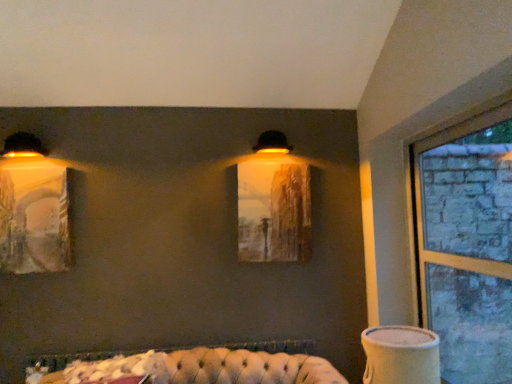
What do you see at coordinates (466, 244) in the screenshot? This screenshot has width=512, height=384. I see `clear glass window at right` at bounding box center [466, 244].

This screenshot has width=512, height=384. In order to click on matte yellow wall sconce at left, the 2th lamp viewed from the top in this screenshot , I will do `click(24, 152)`.

The width and height of the screenshot is (512, 384). What do you see at coordinates (24, 152) in the screenshot? I see `matte yellow wall sconce at left, the second lamp from the bottom` at bounding box center [24, 152].

You are a GUI agent. You are given a task and a screenshot of the screen. Output one action in this format:
    pyautogui.click(x=<x>, y=<y>)
    Task: Click on the matte black lampshade at upper center, arranged as the third lamp when ordered from the bottom
    This screenshot has width=512, height=384.
    Given the screenshot: What is the action you would take?
    pyautogui.click(x=272, y=143)

In order to face matte black lampshade at upper center, marked as the 3th lamp in a left-to-right arrangement, should I rotate leftwards or rightwards?

You should look right and rotate roughly 2.201 degrees.

Describe the element at coordinates (401, 355) in the screenshot. This screenshot has height=384, width=512. I see `white ceramic vase at lower right` at that location.

The width and height of the screenshot is (512, 384). Identify the location of tufted leather couch at lower center. (204, 368).

Considering the relative positions of tufted leather couch at lower center and matte glass painting at center in the image provided, is tufted leather couch at lower center to the right of matte glass painting at center from the viewer's perspective?

Incorrect, tufted leather couch at lower center is not on the right side of matte glass painting at center.

Is tufted leather couch at lower center with matte glass painting at center?

tufted leather couch at lower center and matte glass painting at center are not in contact.

Is tufted leather couch at lower center oriented towards matte glass painting at center?

No.

Would you say tufted leather couch at lower center is inside or outside matte glass painting at center?

tufted leather couch at lower center is not inside matte glass painting at center, it's outside.

Does white ceramic vase at lower right have a smaller size compared to matte yellow wall sconce at left, which appears as the third lamp when viewed from the right?

Actually, white ceramic vase at lower right might be larger than matte yellow wall sconce at left, which appears as the third lamp when viewed from the right.

Based on the photo, does white ceramic vase at lower right have a greater height compared to matte yellow wall sconce at left, the 2th lamp viewed from the top?

Indeed, white ceramic vase at lower right has a greater height compared to matte yellow wall sconce at left, the 2th lamp viewed from the top.

Considering the sizes of objects white ceramic vase at lower right and matte yellow wall sconce at left, the 2th lamp viewed from the top, in the image provided, who is wider, white ceramic vase at lower right or matte yellow wall sconce at left, the 2th lamp viewed from the top,?

white ceramic vase at lower right.

This screenshot has height=384, width=512. Identify the location of the 2nd lamp above the white ceramic vase at lower right (from a real-world perspective). (24, 152).

From a real-world perspective, who is located higher, matte glass painting at center or white ceramic vase at lower right?

matte glass painting at center.

Is matte glass painting at center wider than white ceramic vase at lower right?

Incorrect, the width of matte glass painting at center does not surpass that of white ceramic vase at lower right.

From the image's perspective, between matte glass painting at center and white ceramic vase at lower right, who is located below?

white ceramic vase at lower right is shown below in the image.

Which is nearer, (x=292, y=211) or (x=35, y=266)?

The point (x=35, y=266) is more forward.

From the image's perspective, would you say matte glass painting at center is positioned over matte yellow lampshade at left, which is counted as the second lamp, starting from the right?

Yes, from the image's perspective, matte glass painting at center is above matte yellow lampshade at left, which is counted as the second lamp, starting from the right.

Considering the relative positions of matte glass painting at center and matte yellow lampshade at left, positioned as the third lamp in top-to-bottom order, in the image provided, is matte glass painting at center behind matte yellow lampshade at left, positioned as the third lamp in top-to-bottom order,?

Yes, it is behind matte yellow lampshade at left, positioned as the third lamp in top-to-bottom order.

Measure the distance from matte glass painting at center to matte yellow lampshade at left, which is counted as the second lamp, starting from the right.

A distance of 3.94 feet exists between matte glass painting at center and matte yellow lampshade at left, which is counted as the second lamp, starting from the right.

Does point (271, 138) appear closer or farther from the camera than point (368, 333)?

Point (271, 138) appears to be farther away from the viewer than point (368, 333).

Can you confirm if matte black lampshade at upper center, arranged as the third lamp when ordered from the bottom, is taller than white ceramic vase at lower right?

No.

Looking at this image, from a real-world perspective, is matte black lampshade at upper center, marked as the 3th lamp in a left-to-right arrangement, above or below white ceramic vase at lower right?

In terms of real-world spatial position, matte black lampshade at upper center, marked as the 3th lamp in a left-to-right arrangement, is above white ceramic vase at lower right.

Is white ceramic vase at lower right located within matte black lampshade at upper center, marked as the 3th lamp in a left-to-right arrangement?

No, matte black lampshade at upper center, marked as the 3th lamp in a left-to-right arrangement, does not contain white ceramic vase at lower right.

Could you tell me if matte yellow lampshade at left, which is counted as the second lamp, starting from the right, is facing matte yellow wall sconce at left, the 1th lamp viewed from the left?

No, matte yellow lampshade at left, which is counted as the second lamp, starting from the right, does not turn towards matte yellow wall sconce at left, the 1th lamp viewed from the left.

Is matte yellow lampshade at left, acting as the first lamp starting from the bottom, further to camera compared to matte yellow wall sconce at left, the 2th lamp viewed from the top?

That is True.

Would you say matte yellow lampshade at left, positioned as the third lamp in top-to-bottom order, is outside matte yellow wall sconce at left, the 1th lamp viewed from the left?

Yes, matte yellow lampshade at left, positioned as the third lamp in top-to-bottom order, is located beyond the bounds of matte yellow wall sconce at left, the 1th lamp viewed from the left.

Considering the relative sizes of matte yellow lampshade at left, placed as the 2th lamp when sorted from left to right, and matte yellow wall sconce at left, the 1th lamp viewed from the left, in the image provided, is matte yellow lampshade at left, placed as the 2th lamp when sorted from left to right, smaller than matte yellow wall sconce at left, the 1th lamp viewed from the left,?

No.

Does matte yellow wall sconce at left, the second lamp from the bottom, have a lesser height compared to clear glass window at right?

Indeed, matte yellow wall sconce at left, the second lamp from the bottom, has a lesser height compared to clear glass window at right.

Can you tell me how much matte yellow wall sconce at left, the 1th lamp viewed from the left, and clear glass window at right differ in facing direction?

The facing directions of matte yellow wall sconce at left, the 1th lamp viewed from the left, and clear glass window at right are 92.8 degrees apart.

Between point (16, 163) and point (455, 332), which one is positioned behind?

The point (16, 163) is more distant.

From the image's perspective, does matte yellow wall sconce at left, which appears as the third lamp when viewed from the right, appear lower than clear glass window at right?

No, from the image's perspective, matte yellow wall sconce at left, which appears as the third lamp when viewed from the right, is not below clear glass window at right.

At what (x,y) coordinates should I click in order to perform the action: click on couch in front of the matte glass painting at center. Please return your answer as a coordinate pair (x, y). This screenshot has height=384, width=512. Looking at the image, I should click on (204, 368).

Image resolution: width=512 pixels, height=384 pixels. What are the coordinates of `the 2nd lamp positioned above the white ceramic vase at lower right (from the image's perspective)` in the screenshot? It's located at (24, 152).

Considering their positions, is matte yellow lampshade at left, which is counted as the second lamp, starting from the right, positioned closer to matte glass painting at center than white ceramic vase at lower right?

Based on the image, white ceramic vase at lower right appears to be nearer to matte glass painting at center.

Based on their spatial positions, is white ceramic vase at lower right or clear glass window at right closer to tufted leather couch at lower center?

white ceramic vase at lower right lies closer to tufted leather couch at lower center than the other object.

Consider the image. Considering their positions, is tufted leather couch at lower center positioned closer to matte yellow lampshade at left, positioned as the third lamp in top-to-bottom order, than white ceramic vase at lower right?

Based on the image, tufted leather couch at lower center appears to be nearer to matte yellow lampshade at left, positioned as the third lamp in top-to-bottom order.

Based on their spatial positions, is matte black lampshade at upper center, acting as the 1th lamp starting from the right, or clear glass window at right further from matte glass painting at center?

Among the two, clear glass window at right is located further to matte glass painting at center.

From the image, which object appears to be nearer to white ceramic vase at lower right, tufted leather couch at lower center or matte yellow lampshade at left, acting as the first lamp starting from the bottom?

tufted leather couch at lower center is positioned closer to the anchor white ceramic vase at lower right.

Considering their positions, is matte yellow lampshade at left, which is counted as the second lamp, starting from the right, positioned closer to white ceramic vase at lower right than matte glass painting at center?

matte glass painting at center.

When comparing their distances from matte glass painting at center, does white ceramic vase at lower right or matte black lampshade at upper center, acting as the 1th lamp starting from the right, seem further?

white ceramic vase at lower right lies further to matte glass painting at center than the other object.

Considering their positions, is matte yellow lampshade at left, positioned as the third lamp in top-to-bottom order, positioned further to clear glass window at right than white ceramic vase at lower right?

matte yellow lampshade at left, positioned as the third lamp in top-to-bottom order.

Image resolution: width=512 pixels, height=384 pixels. I want to click on couch between matte yellow lampshade at left, acting as the first lamp starting from the bottom, and white ceramic vase at lower right from left to right, so click(x=204, y=368).

The height and width of the screenshot is (384, 512). Identify the location of couch between matte yellow wall sconce at left, the 1th lamp viewed from the left, and matte glass painting at center from left to right. click(204, 368).

The height and width of the screenshot is (384, 512). What are the coordinates of `couch between matte yellow lampshade at left, acting as the first lamp starting from the bottom, and clear glass window at right, in the horizontal direction` in the screenshot? It's located at (204, 368).

Image resolution: width=512 pixels, height=384 pixels. Identify the location of lamp that lies between matte yellow wall sconce at left, the 2th lamp viewed from the top, and tufted leather couch at lower center from top to bottom. (33, 209).